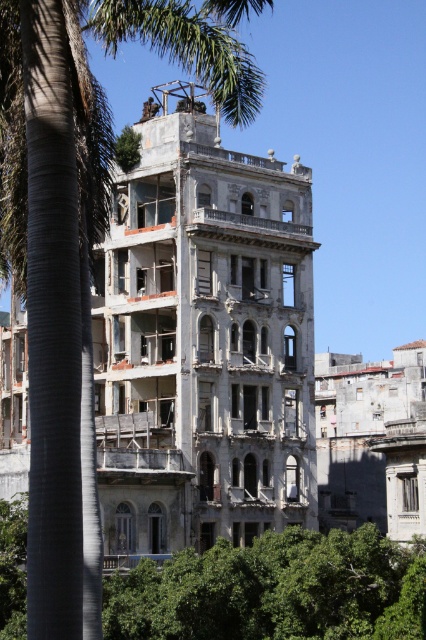
Can you confirm if green leafy palm tree at left is positioned to the right of green leafy tree at center?

In fact, green leafy palm tree at left is to the left of green leafy tree at center.

Who is more forward, (34, 180) or (13, 529)?

Positioned in front is point (34, 180).

What do you see at coordinates (80, 268) in the screenshot? This screenshot has height=640, width=426. I see `green leafy palm tree at left` at bounding box center [80, 268].

The image size is (426, 640). In order to click on green leafy palm tree at left in this screenshot , I will do `click(80, 268)`.